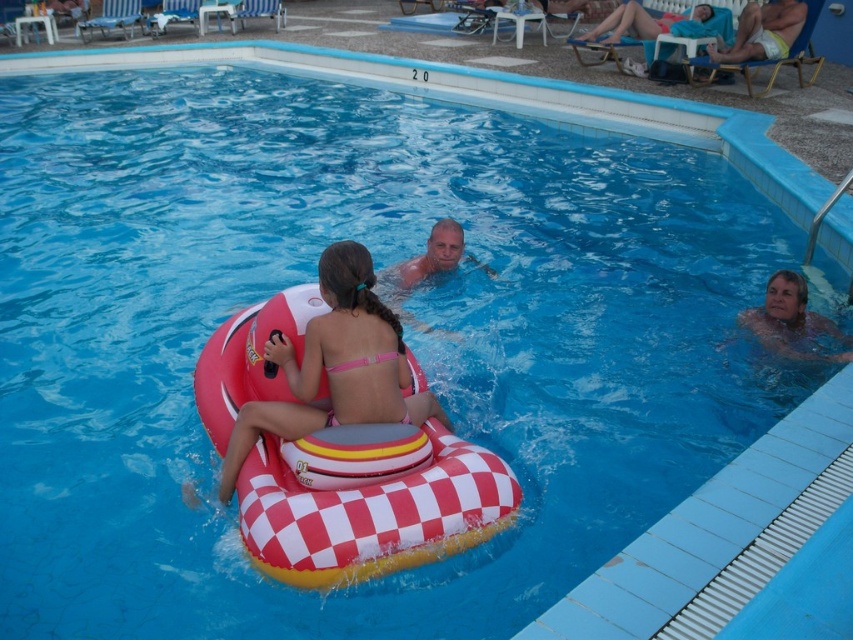
Is matte pink bikini at center thinner than white cotton shorts at upper right?

Yes.

Can you confirm if matte pink bikini at center is wider than white cotton shorts at upper right?

In fact, matte pink bikini at center might be narrower than white cotton shorts at upper right.

Which is behind, point (347, 392) or point (787, 33)?

The point (787, 33) is more distant.

I want to click on matte pink bikini at center, so click(335, 365).

Who is positioned more to the left, matte pink bikini at center or smooth skin man at right?

matte pink bikini at center

Is point (368, 308) closer to viewer compared to point (788, 276)?

Yes.

Between point (299, 435) and point (779, 326), which one is positioned behind?

The point (779, 326) is more distant.

In order to click on matte pink bikini at center in this screenshot , I will do `click(335, 365)`.

Who is positioned more to the left, smooth skin man at right or white cotton shorts at upper right?

smooth skin man at right

Consider the image. Measure the distance between smooth skin man at right and white cotton shorts at upper right.

smooth skin man at right is 24.20 feet away from white cotton shorts at upper right.

Is point (805, 340) closer to viewer compared to point (753, 45)?

Yes, it is.

Where is `smooth skin man at right`? smooth skin man at right is located at coordinates (791, 321).